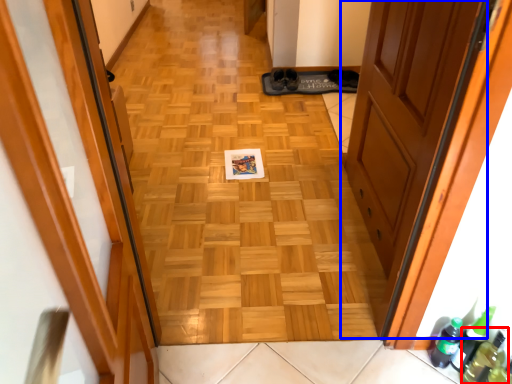
Question: Among these objects, which one is nearest to the camera, bottle (highlighted by a red box) or door (highlighted by a blue box)?

Choices:
 (A) bottle
 (B) door

Answer: (B)